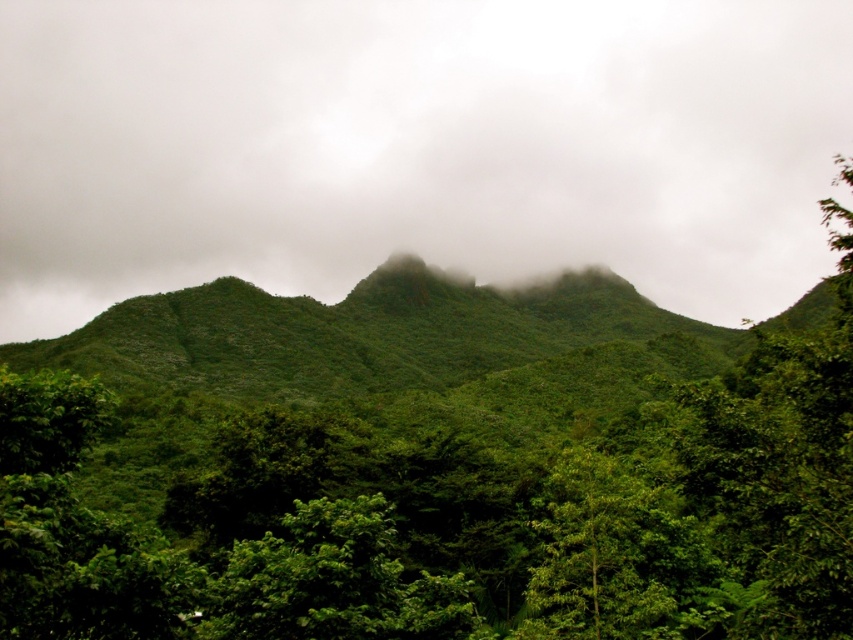
Who is taller, foggy misty mountain at upper center or green leafy tree at lower center?

Standing taller between the two is foggy misty mountain at upper center.

What do you see at coordinates (416, 147) in the screenshot? I see `foggy misty mountain at upper center` at bounding box center [416, 147].

The image size is (853, 640). Find the location of `foggy misty mountain at upper center`. foggy misty mountain at upper center is located at coordinates (416, 147).